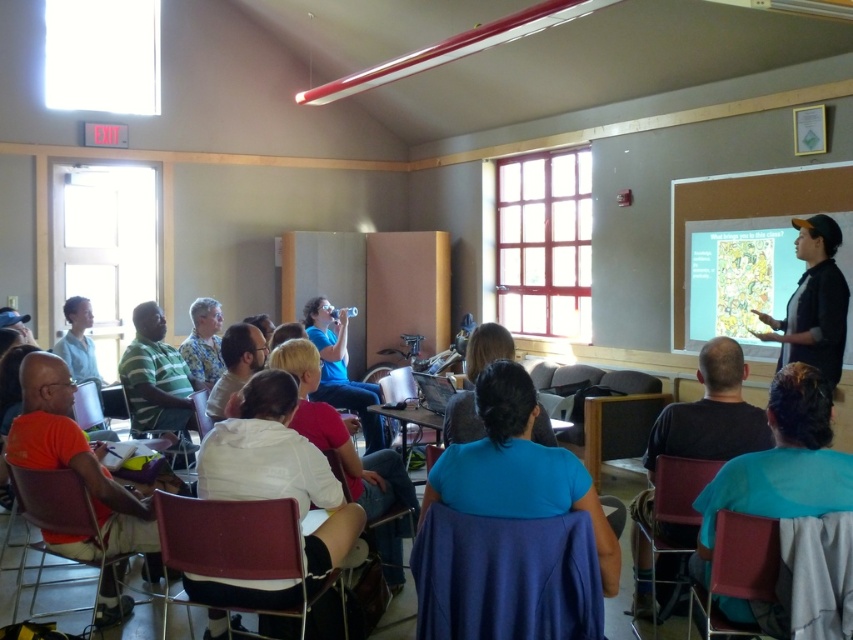
Is orange matte shirt at lower left to the left of light blue shirt at lower left from the viewer's perspective?

In fact, orange matte shirt at lower left is to the right of light blue shirt at lower left.

Is point (120, 513) in front of point (83, 376)?

Yes, it is in front of point (83, 376).

I want to click on orange matte shirt at lower left, so click(x=74, y=465).

Is orange matte shirt at lower left taller than matte blue shirt at center?

No, orange matte shirt at lower left is not taller than matte blue shirt at center.

Is orange matte shirt at lower left closer to the viewer compared to matte blue shirt at center?

Yes, orange matte shirt at lower left is in front of matte blue shirt at center.

Is point (106, 515) closer to viewer compared to point (370, 396)?

Yes, it is.

Identify the location of orange matte shirt at lower left. (74, 465).

Does blue fabric shirt at lower right appear over dark blue shirt at lower center?

Indeed, blue fabric shirt at lower right is positioned over dark blue shirt at lower center.

This screenshot has height=640, width=853. I want to click on blue fabric shirt at lower right, so click(790, 513).

Who is more forward, (717, 476) or (665, 429)?

Point (717, 476)

Where is `blue fabric shirt at lower right`? blue fabric shirt at lower right is located at coordinates (790, 513).